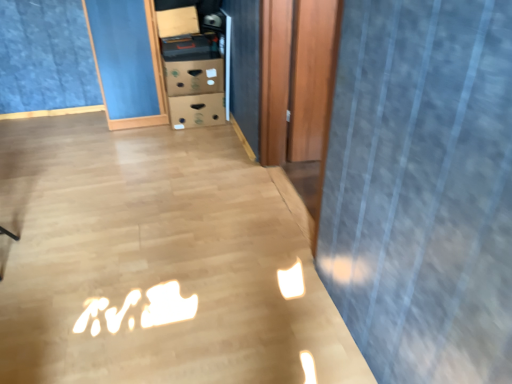
Question: Should I look upward or downward to see wooden door at center?

Choices:
 (A) up
 (B) down

Answer: (A)